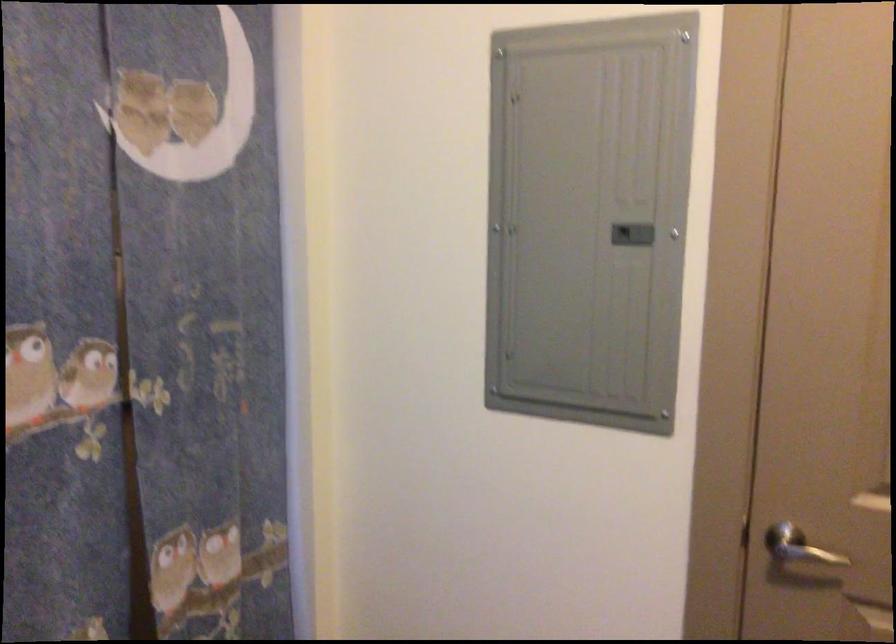
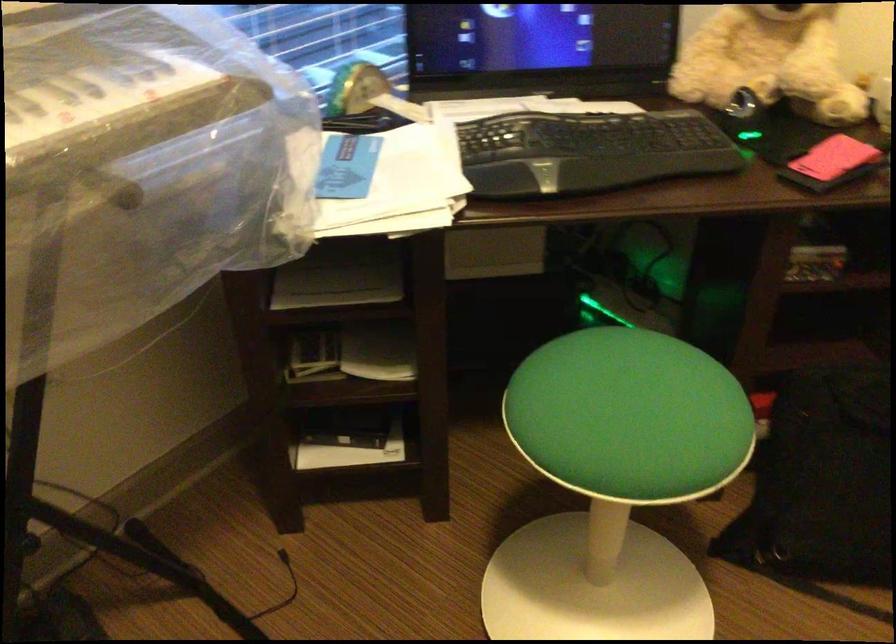
The images are taken continuously from a first-person perspective. In which direction is your viewpoint rotating?

The camera rotated toward left-down.